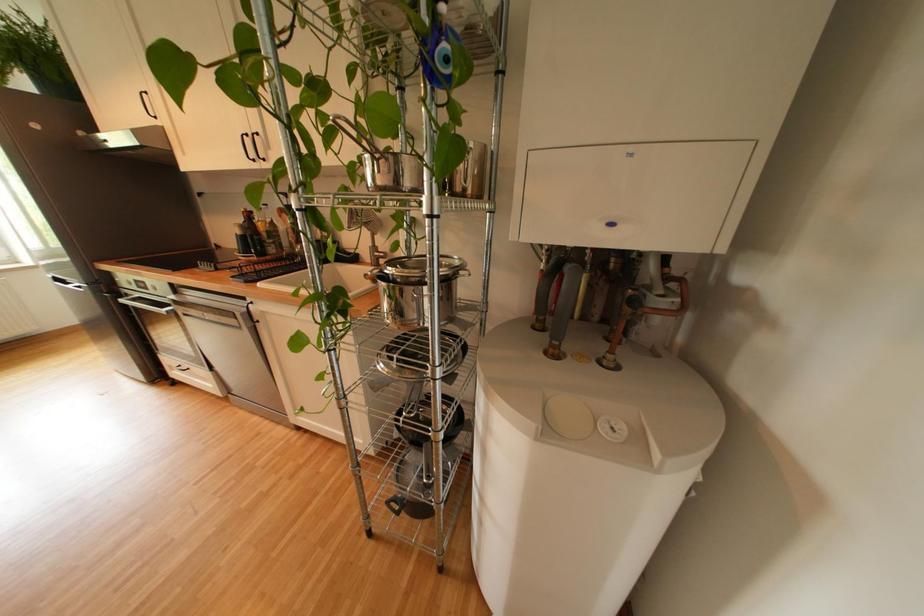
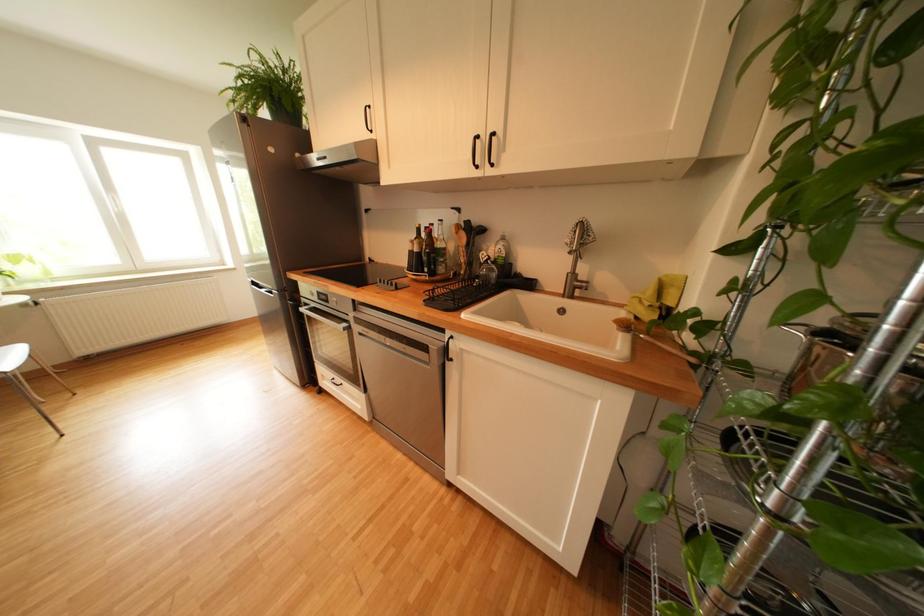
Question: The first image is from the beginning of the video and the second image is from the end. How did the camera likely rotate when shooting the video?

Choices:
 (A) Left
 (B) Right
 (C) Up
 (D) Down

Answer: (A)